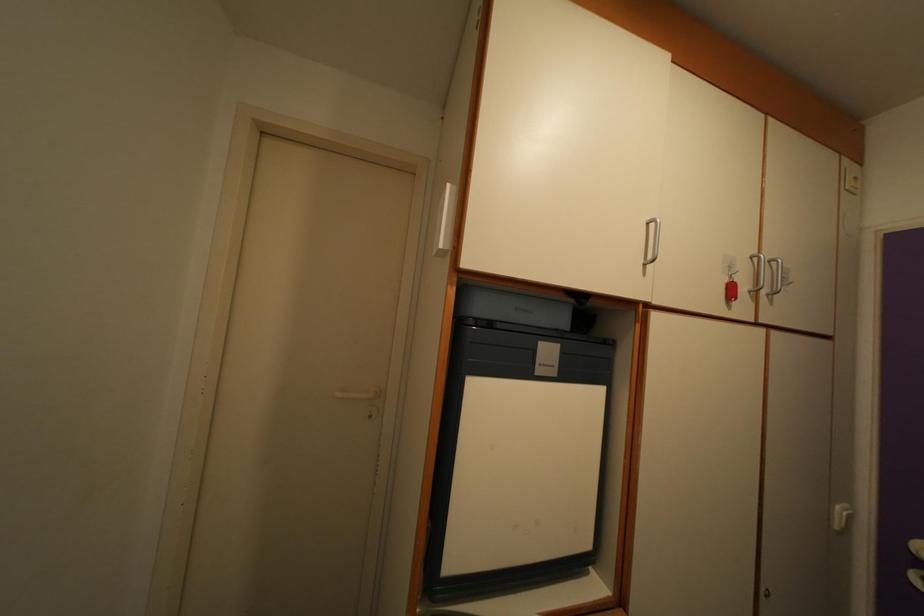
Describe the element at coordinates (358, 394) in the screenshot. I see `a white door handle` at that location.